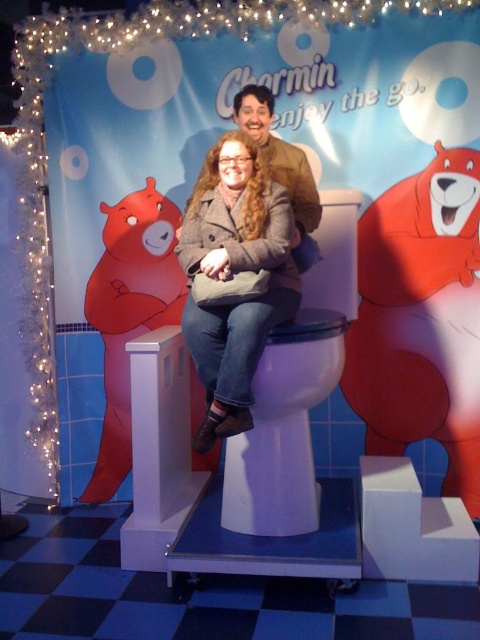
Question: Does matte gray coat at center have a greater width compared to white glossy toilet bowl at center?

Choices:
 (A) no
 (B) yes

Answer: (A)

Question: Is white glossy toilet bowl at center positioned before matte red bear at left?

Choices:
 (A) yes
 (B) no

Answer: (A)

Question: Among these points, which one is farthest from the camera?

Choices:
 (A) (117, 296)
 (B) (228, 141)

Answer: (A)

Question: Does matte gray coat at center come in front of matte red bear at left?

Choices:
 (A) yes
 (B) no

Answer: (A)

Question: Among these objects, which one is farthest from the camera?

Choices:
 (A) matte gray coat at center
 (B) white glossy toilet bowl at center
 (C) matte red bear at center
 (D) matte red bear at left

Answer: (D)

Question: Among these objects, which one is nearest to the camera?

Choices:
 (A) matte gray coat at center
 (B) white glossy toilet bowl at center
 (C) matte red bear at left
 (D) matte red bear at center

Answer: (A)